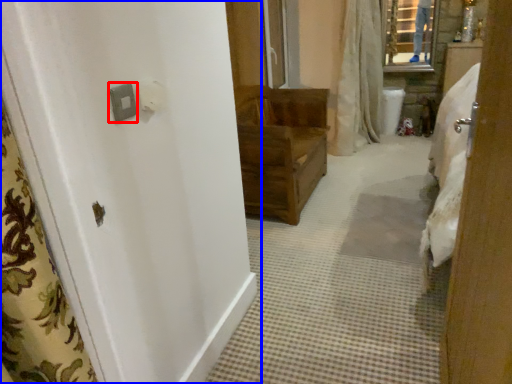
Question: Which object appears farthest to the camera in this image, light switch (highlighted by a red box) or door (highlighted by a blue box)?

Choices:
 (A) light switch
 (B) door

Answer: (A)